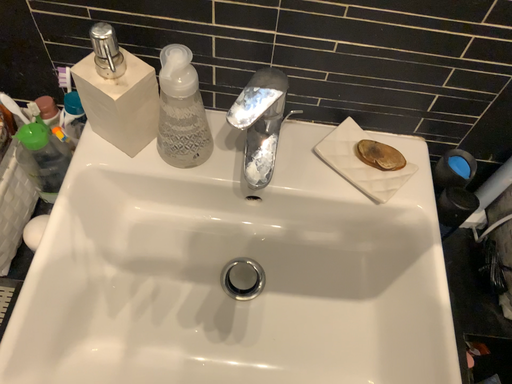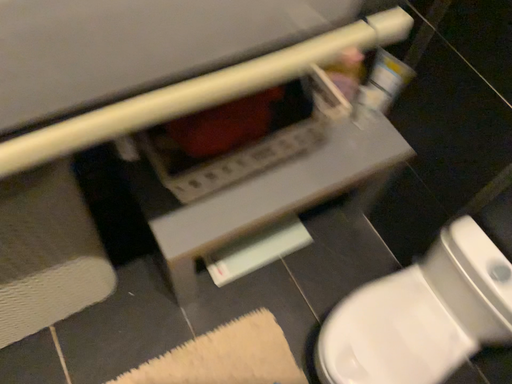
Question: How did the camera likely rotate when shooting the video?

Choices:
 (A) rotated left
 (B) rotated right

Answer: (B)